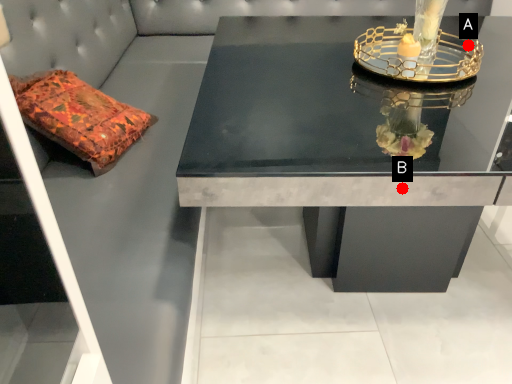
Question: Two points are circled on the image, labeled by A and B beside each circle. Which point is closer to the camera taking this photo?

Choices:
 (A) A is closer
 (B) B is closer

Answer: (B)